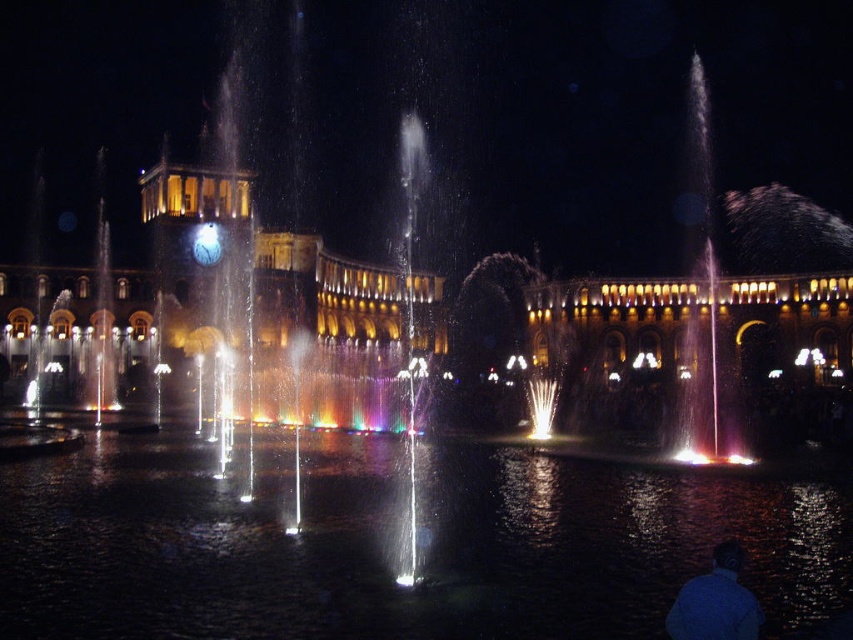
You are standing in the plaza and see the clear liquid water at center and the translucent glass water at right. Which one is closer to the ground?

The clear liquid water at center is closer to the ground because it is located below the translucent glass water at right.

You are standing in the plaza and want to take a photo of the translucent glass water at right using a camera. The camera is set to capture objects within a 70 meters range. Can you take the photo without moving closer?

The distance between the translucent glass water at right and the camera is 77.13 meters, which exceeds the camera range of 70 meters. Therefore, you cannot take the photo without moving closer.

You are a photographer standing in the square and want to capture both the clear liquid water at center and the translucent glass water at right in a single photo. Which one of these objects will appear taller in the photo?

The translucent glass water at right will appear taller in the photo because the clear liquid water at center is shorter than the translucent glass water at right.